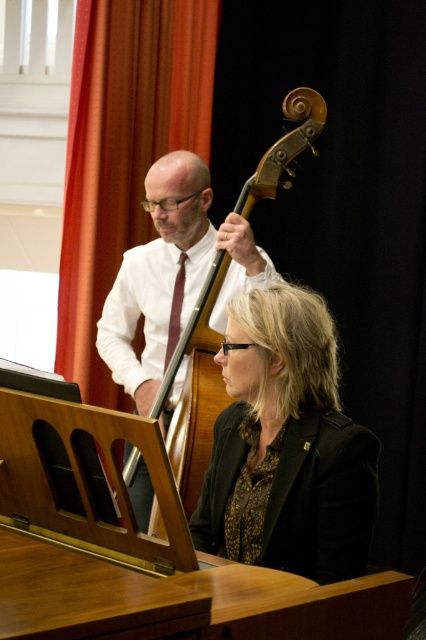
Question: Which point is closer to the camera?

Choices:
 (A) (181, 276)
 (B) (175, 464)

Answer: (B)

Question: Which of the following is the closest to the observer?

Choices:
 (A) wooden cello at center
 (B) black textured blazer at center

Answer: (B)

Question: Is wooden cello at center positioned at the back of maroon satin tie at center?

Choices:
 (A) yes
 (B) no

Answer: (B)

Question: Does black textured blazer at center appear over wooden cello at center?

Choices:
 (A) yes
 (B) no

Answer: (B)

Question: Is wooden cello at center bigger than maroon satin tie at center?

Choices:
 (A) yes
 (B) no

Answer: (A)

Question: Among these points, which one is farthest from the camera?

Choices:
 (A) (239, 205)
 (B) (172, 298)

Answer: (B)